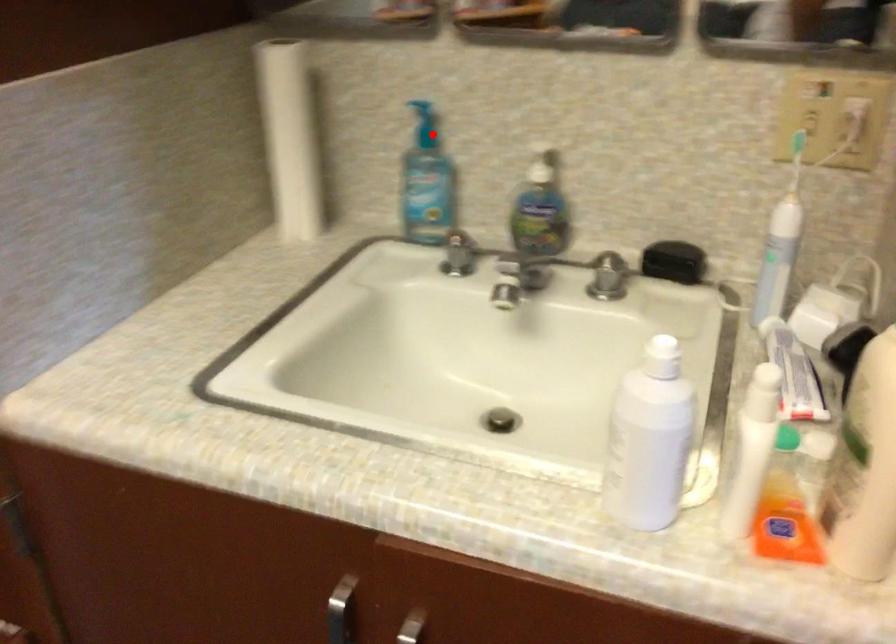
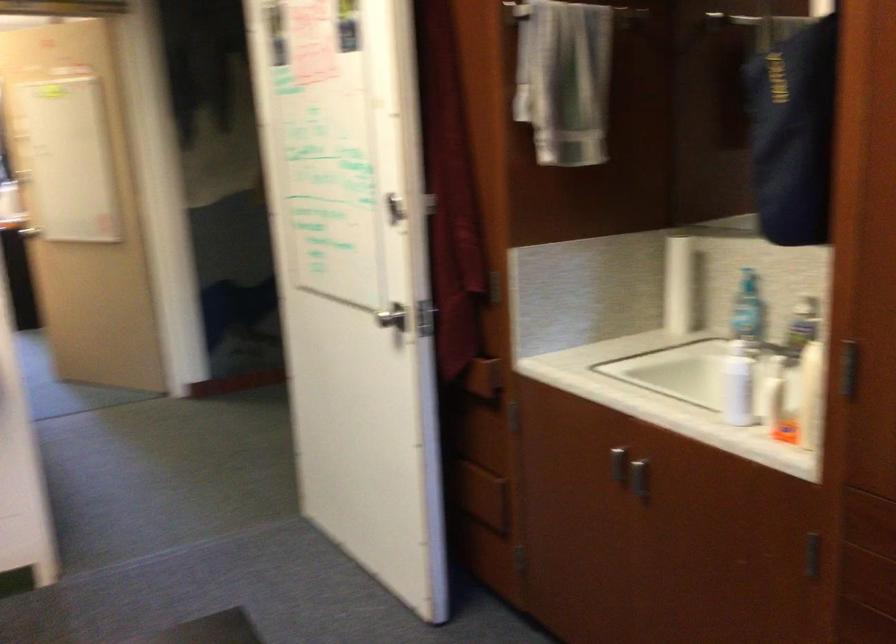
Question: I am providing you with two images of the same scene from different viewpoints. In image1, a red point is highlighted. Considering the same 3D point in image2, which of the following is correct?

Choices:
 (A) It is closer
 (B) It is farther

Answer: (B)